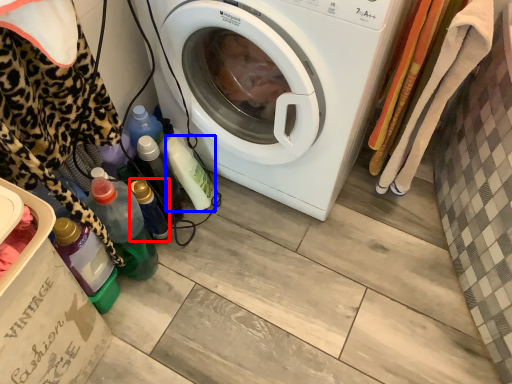
Question: Among these objects, which one is nearest to the camera, bottle (highlighted by a red box) or bottle (highlighted by a blue box)?

Choices:
 (A) bottle
 (B) bottle

Answer: (A)